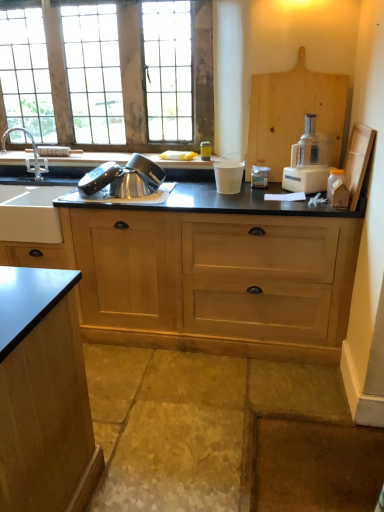
Question: Is metallic silver colander at sink taller than black matte countertop at center?

Choices:
 (A) yes
 (B) no

Answer: (B)

Question: Is metallic silver colander at sink bigger than black matte countertop at center?

Choices:
 (A) no
 (B) yes

Answer: (A)

Question: From the image's perspective, is metallic silver colander at sink located beneath black matte countertop at center?

Choices:
 (A) no
 (B) yes

Answer: (A)

Question: Would you consider metallic silver colander at sink to be distant from black matte countertop at center?

Choices:
 (A) yes
 (B) no

Answer: (B)

Question: Is metallic silver colander at sink oriented towards black matte countertop at center?

Choices:
 (A) yes
 (B) no

Answer: (B)

Question: Is black matte countertop at center inside or outside of white plastic food processor at right?

Choices:
 (A) inside
 (B) outside

Answer: (B)

Question: Is black matte countertop at center in front of or behind white plastic food processor at right in the image?

Choices:
 (A) behind
 (B) front

Answer: (B)

Question: Considering the positions of black matte countertop at center and white plastic food processor at right in the image, is black matte countertop at center wider or thinner than white plastic food processor at right?

Choices:
 (A) thin
 (B) wide

Answer: (B)

Question: Considering the positions of black matte countertop at center and white plastic food processor at right in the image, is black matte countertop at center taller or shorter than white plastic food processor at right?

Choices:
 (A) short
 (B) tall

Answer: (B)

Question: Visually, is white plastic food processor at right positioned to the left or to the right of black matte countertop at center?

Choices:
 (A) left
 (B) right

Answer: (B)

Question: Based on their sizes in the image, would you say white plastic food processor at right is bigger or smaller than black matte countertop at center?

Choices:
 (A) small
 (B) big

Answer: (A)

Question: Is point (319, 169) closer or farther from the camera than point (6, 262)?

Choices:
 (A) farther
 (B) closer

Answer: (B)

Question: Relative to black matte countertop at center, is white plastic food processor at right in front or behind?

Choices:
 (A) front
 (B) behind

Answer: (B)

Question: In the image, is white plastic food processor at right on the left side or the right side of metallic silver colander at sink?

Choices:
 (A) left
 (B) right

Answer: (B)

Question: Is point (296, 190) positioned closer to the camera than point (84, 181)?

Choices:
 (A) farther
 (B) closer

Answer: (B)